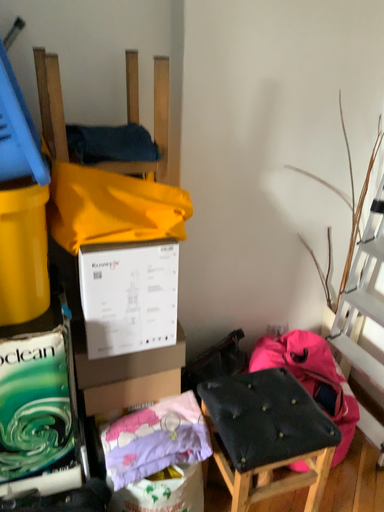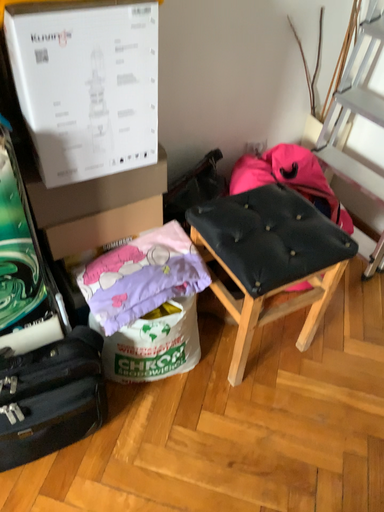
Question: Which way did the camera rotate in the video?

Choices:
 (A) rotated left
 (B) rotated right

Answer: (B)